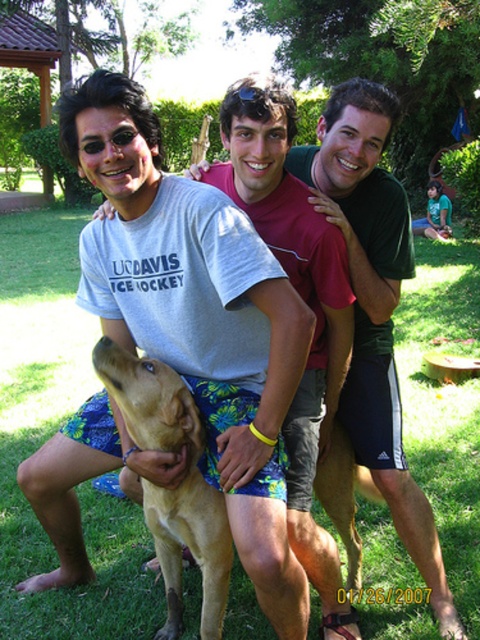
You are a photographer trying to capture a photo of the light brown fur dog at center and the blue plastic goggles at center. Based on their positions, which object should you focus on first if you want to include both in your shot without moving the camera?

The light brown fur dog at center is to the left of blue plastic goggles at center, so you should focus on the light brown fur dog at center first to ensure both are in frame without moving the camera.

You are a photographer standing at the center of the scene. You want to take a photo that includes both the point at point (31,586) and point (197,456). Which point is closer to your camera?

Point (31,586) is closer to the camera than point (197,456) because it is further to the camera than the other point.

You are a photographer standing in front of the scene. You want to take a photo of the green grass at center and the golden fur dog at center. Which object is closer to you?

The green grass at center is closer to you because it is further to the viewer than the golden fur dog at center.